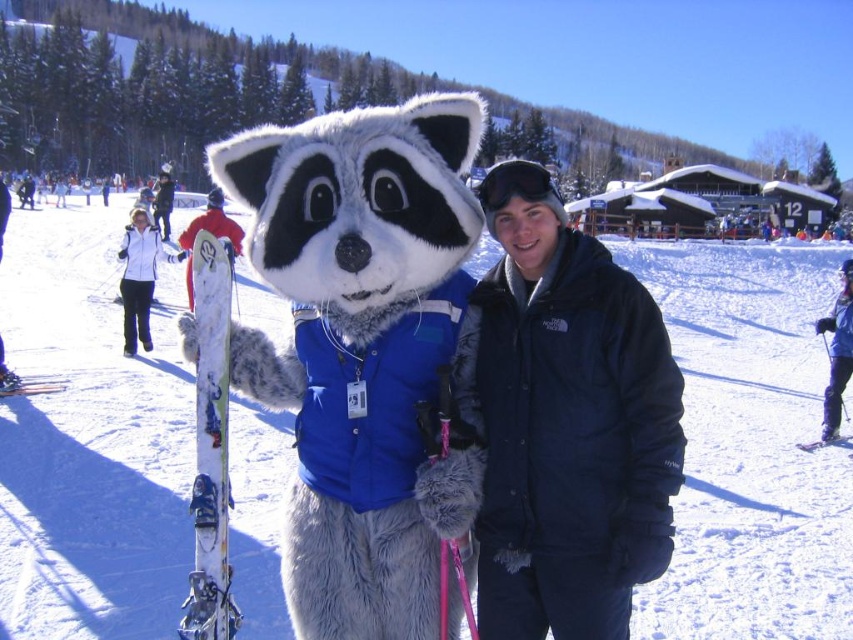
Does point (848, 577) come behind point (199, 387)?

That is True.

Does white fluffy mascot at center have a greater width compared to white glossy skis at left?

Correct, the width of white fluffy mascot at center exceeds that of white glossy skis at left.

Image resolution: width=853 pixels, height=640 pixels. What are the coordinates of `white fluffy mascot at center` in the screenshot? It's located at (90, 438).

Can you confirm if dark blue puffy jacket at center is shorter than white plastic ski at lower right?

In fact, dark blue puffy jacket at center may be taller than white plastic ski at lower right.

Who is shorter, dark blue puffy jacket at center or white plastic ski at lower right?

white plastic ski at lower right is shorter.

Between point (514, 266) and point (833, 438), which one is positioned behind?

Positioned behind is point (833, 438).

Locate an element on the screen. This screenshot has height=640, width=853. dark blue puffy jacket at center is located at coordinates (570, 433).

Is black matte goggles at center to the left of white matte ski at lower left from the viewer's perspective?

In fact, black matte goggles at center is to the right of white matte ski at lower left.

What do you see at coordinates (515, 184) in the screenshot?
I see `black matte goggles at center` at bounding box center [515, 184].

You are a GUI agent. You are given a task and a screenshot of the screen. Output one action in this format:
    pyautogui.click(x=<x>, y=<y>)
    Task: Click on the black matte goggles at center
    The image size is (853, 640).
    Given the screenshot: What is the action you would take?
    pyautogui.click(x=515, y=184)